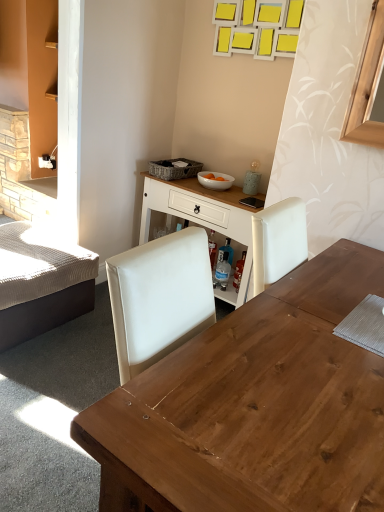
At what (x,y) coordinates should I click in order to perform the action: click on vacant space in front of white glossy bowl at center. Please return your answer as a coordinate pair (x, y). The height and width of the screenshot is (512, 384). Looking at the image, I should click on (221, 195).